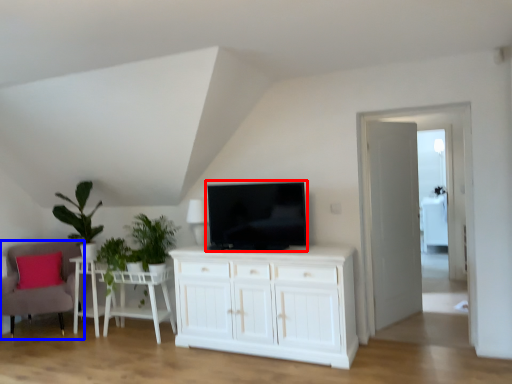
Question: Which object is closer to the camera taking this photo, television (highlighted by a red box) or chair (highlighted by a blue box)?

Choices:
 (A) television
 (B) chair

Answer: (A)